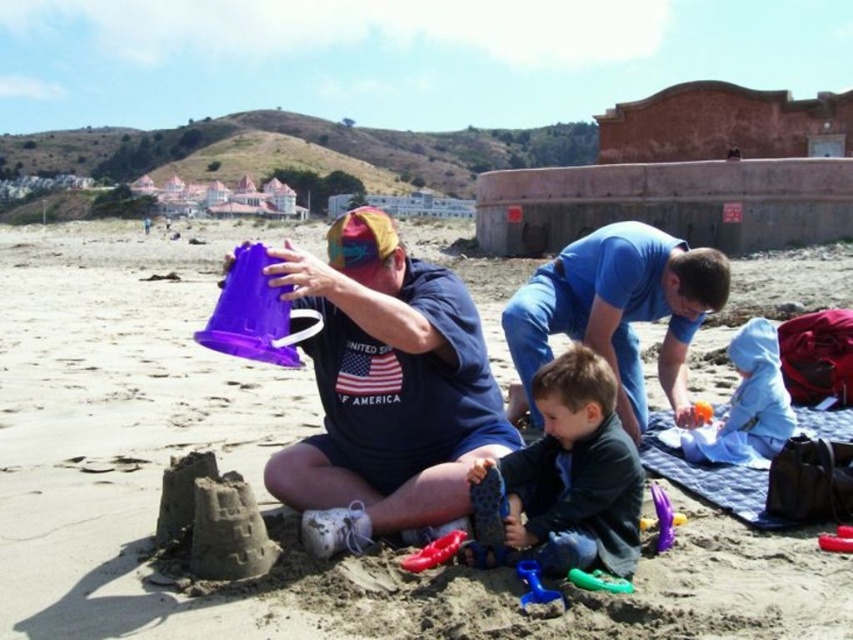
Question: Estimate the real-world distances between objects in this image. Which object is farther from the blue rubber boot at lower center?

Choices:
 (A) rubber red toy at lower center
 (B) dark green fleece jacket at center

Answer: (A)

Question: Considering the relative positions of blue rubber boot at lower center and rubber red shovel at lower right in the image provided, where is blue rubber boot at lower center located with respect to rubber red shovel at lower right?

Choices:
 (A) left
 (B) right

Answer: (A)

Question: Which of the following is the farthest from the observer?

Choices:
 (A) (579, 586)
 (B) (490, 444)
 (C) (526, 566)

Answer: (B)

Question: Which of the following is the closest to the observer?

Choices:
 (A) rubber red shovel at lower right
 (B) rubberized plastic shovel at lower right
 (C) light blue fleece at lower right

Answer: (A)

Question: Observing the image, what is the correct spatial positioning of purple plastic bucket at center in reference to matte purple bucket at center?

Choices:
 (A) above
 (B) below

Answer: (A)

Question: Is rubber red toy at lower center further to camera compared to purple plastic shovel at lower center?

Choices:
 (A) yes
 (B) no

Answer: (B)